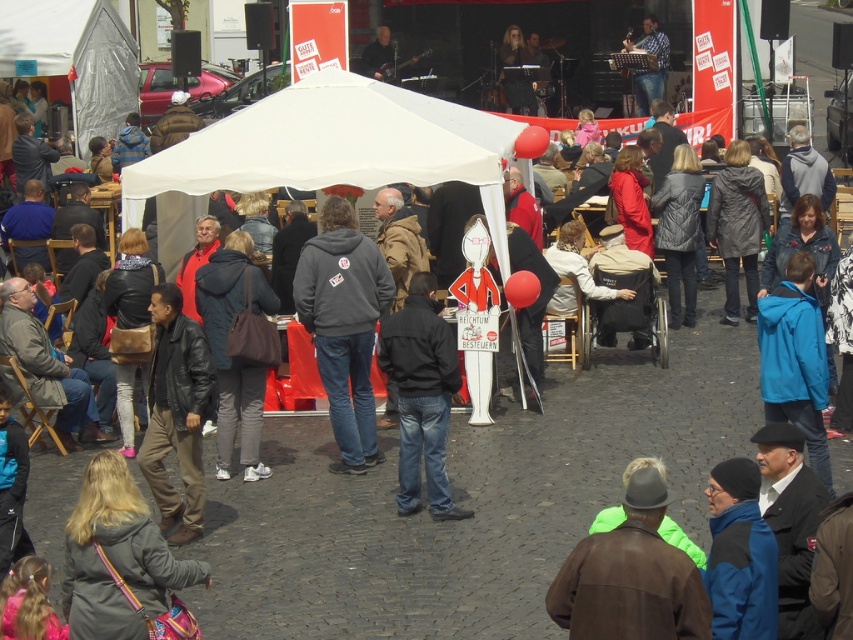
You are organizing a clothing donation drive and need to categorize items based on their size. You have two items to sort out from the event image you are looking at. Which one is wider between the gray hoodie at center and the black matte jacket at center?

The gray hoodie at center is wider than the black matte jacket at center.

You are organizing a photo shoot and need to place a large camera tripod between the brown leather jacket at lower right and the dark blue jacket at center. Considering their sizes, which jacket will require more space for the tripod setup?

The dark blue jacket at center requires more space because it occupies more area than the brown leather jacket at lower right.